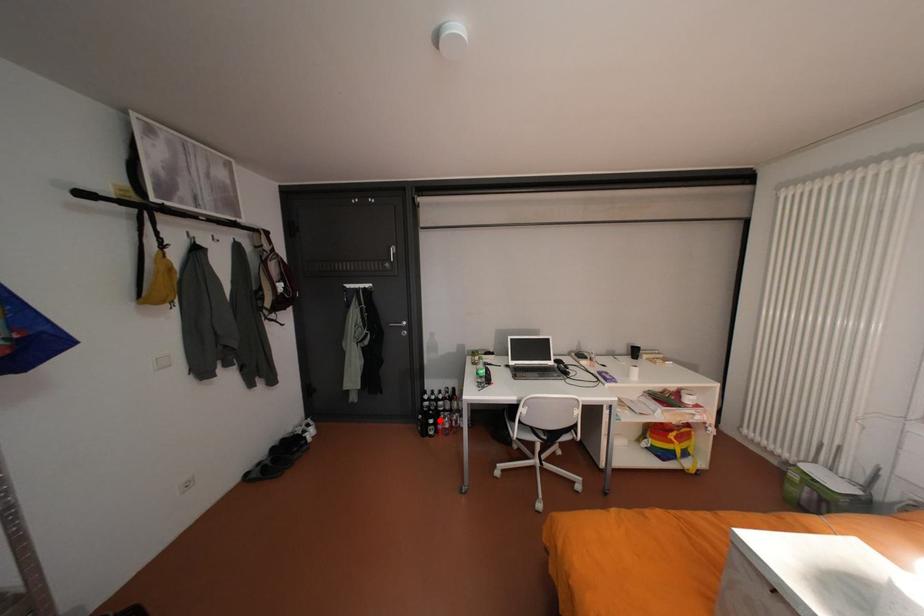
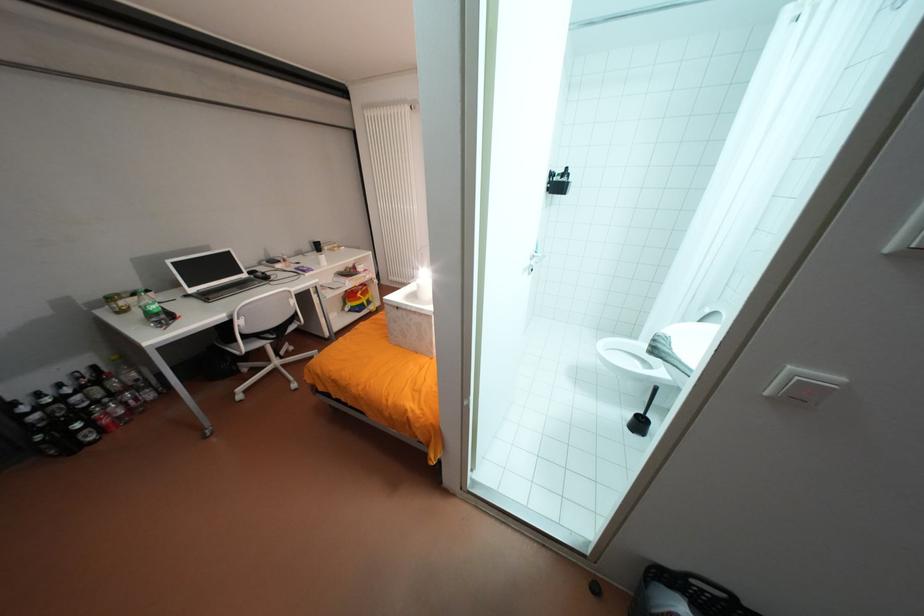
Question: A red point is marked in image1. In image2, is the corresponding 3D point closer to the camera or farther? Reply with the corresponding letter.

Choices:
 (A) The corresponding 3D point is closer.
 (B) The corresponding 3D point is farther.

Answer: (A)